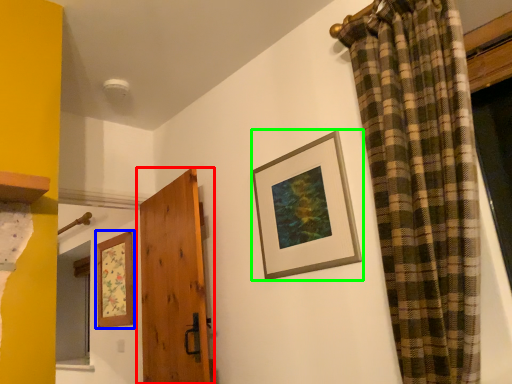
Question: Which object is positioned farthest from door (highlighted by a red box)? Select from picture frame (highlighted by a blue box) and picture frame (highlighted by a green box).

Choices:
 (A) picture frame
 (B) picture frame

Answer: (B)